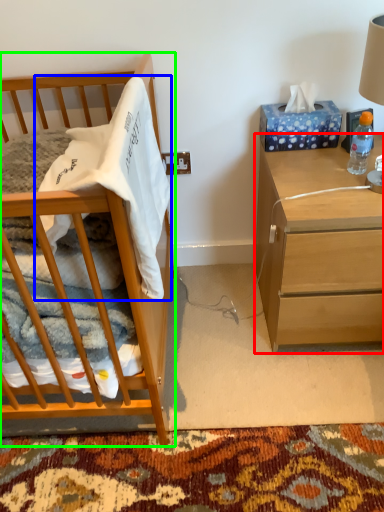
Question: Estimate the real-world distances between objects in this image. Which object is closer to nightstand (highlighted by a red box), blanket (highlighted by a blue box) or cabinetry (highlighted by a green box)?

Choices:
 (A) blanket
 (B) cabinetry

Answer: (A)